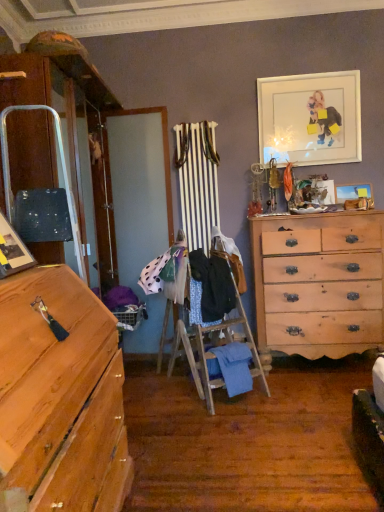
Question: In terms of size, does matte black picture frame at left, placed as the 1th picture frame when sorted from left to right, appear bigger or smaller than white matte picture frame at upper right, which is the 2th picture frame in right-to-left order?

Choices:
 (A) small
 (B) big

Answer: (A)

Question: Is point (1, 227) positioned closer to the camera than point (319, 139)?

Choices:
 (A) farther
 (B) closer

Answer: (B)

Question: Considering the real-world distances, which object is closest to the light brown wooden chest of drawers at right?

Choices:
 (A) wooden picture frame at upper right, the second picture frame when ordered from top to bottom
 (B) polka dot fabric at center, positioned as the 4th clothing in bottom-to-top order
 (C) blue cotton blanket at center, which is the 1th clothing from bottom to top
 (D) dark blue fabric at center, the third clothing in the bottom-to-top sequence
 (E) white matte picture frame at upper right, the 2th picture frame from the left

Answer: (D)

Question: Estimate the real-world distances between objects in this image. Which object is closer to the light brown wooden chest of drawers at right?

Choices:
 (A) matte black picture frame at left, which is the 1th picture frame from front to back
 (B) white matte picture frame at upper right, positioned as the third picture frame in bottom-to-top order
 (C) dark blue fabric at center, the third clothing in the bottom-to-top sequence
 (D) polka dot fabric at center, the 1th clothing viewed from the top
 (E) wooden picture frame at upper right, placed as the 1th picture frame when sorted from right to left

Answer: (C)